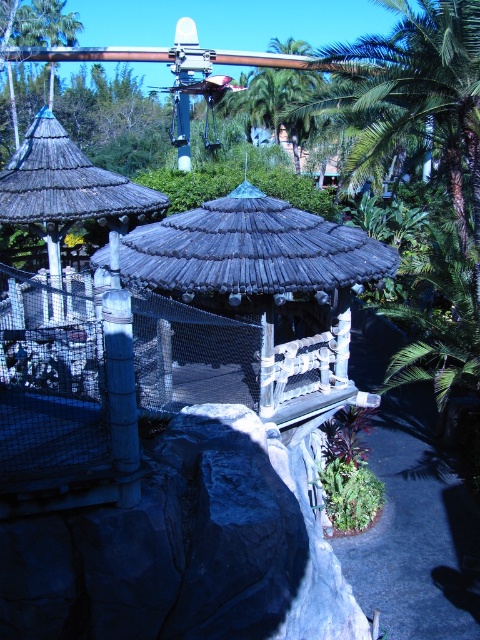
Is wooden thatched roof gazebo at center bigger than smooth bamboo pole at center?

Yes.

Is wooden thatched roof gazebo at center shorter than smooth bamboo pole at center?

Correct, wooden thatched roof gazebo at center is not as tall as smooth bamboo pole at center.

Find the location of a particular element. The width and height of the screenshot is (480, 640). wooden thatched roof gazebo at center is located at coordinates (265, 285).